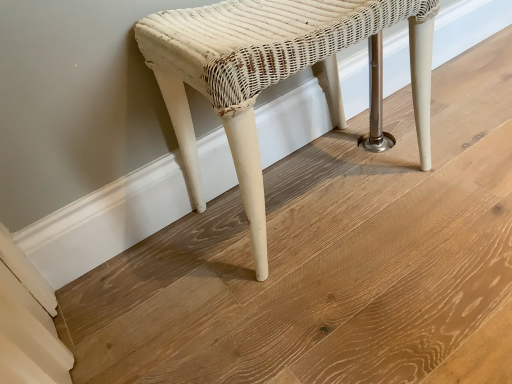
You are a GUI agent. You are given a task and a screenshot of the screen. Output one action in this format:
    pyautogui.click(x=<x>, y=<y>)
    Task: Click on the unoccupied region to the right of white wicker stool at center
    Image resolution: width=512 pixels, height=384 pixels.
    Given the screenshot: What is the action you would take?
    pyautogui.click(x=458, y=183)